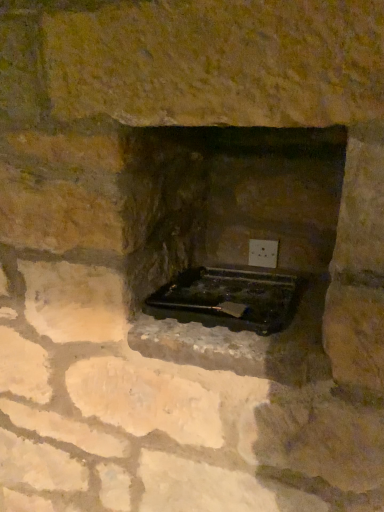
Question: Is white plastic electric outlet at center to the left of black plastic tray at center from the viewer's perspective?

Choices:
 (A) yes
 (B) no

Answer: (B)

Question: Does white plastic electric outlet at center appear on the right side of black plastic tray at center?

Choices:
 (A) no
 (B) yes

Answer: (B)

Question: Is white plastic electric outlet at center next to black plastic tray at center and touching it?

Choices:
 (A) yes
 (B) no

Answer: (B)

Question: Is white plastic electric outlet at center in front of black plastic tray at center?

Choices:
 (A) no
 (B) yes

Answer: (A)

Question: Is white plastic electric outlet at center smaller than black plastic tray at center?

Choices:
 (A) yes
 (B) no

Answer: (A)

Question: Can you confirm if white plastic electric outlet at center is wider than black plastic tray at center?

Choices:
 (A) yes
 (B) no

Answer: (B)

Question: Is black plastic tray at center closer to the viewer compared to white plastic electric outlet at center?

Choices:
 (A) no
 (B) yes

Answer: (B)

Question: Are black plastic tray at center and white plastic electric outlet at center beside each other?

Choices:
 (A) no
 (B) yes

Answer: (A)

Question: From a real-world perspective, is black plastic tray at center below white plastic electric outlet at center?

Choices:
 (A) no
 (B) yes

Answer: (B)

Question: Is black plastic tray at center located outside white plastic electric outlet at center?

Choices:
 (A) no
 (B) yes

Answer: (B)

Question: Can you confirm if black plastic tray at center is wider than white plastic electric outlet at center?

Choices:
 (A) no
 (B) yes

Answer: (B)

Question: Considering the relative positions of black plastic tray at center and white plastic electric outlet at center in the image provided, is black plastic tray at center to the right of white plastic electric outlet at center from the viewer's perspective?

Choices:
 (A) no
 (B) yes

Answer: (A)

Question: From a real-world perspective, is white plastic electric outlet at center positioned above or below black plastic tray at center?

Choices:
 (A) below
 (B) above

Answer: (B)